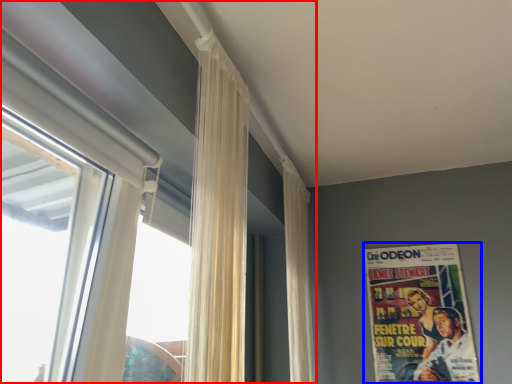
Question: Which object appears closest to the camera in this image, window (highlighted by a red box) or poster (highlighted by a blue box)?

Choices:
 (A) window
 (B) poster

Answer: (A)